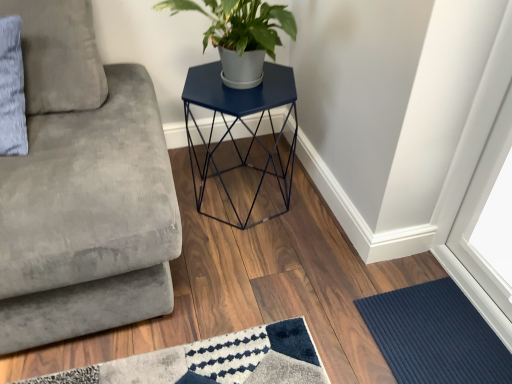
The height and width of the screenshot is (384, 512). What do you see at coordinates (83, 189) in the screenshot? I see `velvet gray studio couch at left` at bounding box center [83, 189].

Image resolution: width=512 pixels, height=384 pixels. I want to click on gray fabric pillow at upper left, so click(59, 55).

Find the location of a particular element. This screenshot has height=384, width=512. matte blue hexagonal table at center is located at coordinates (243, 124).

The width and height of the screenshot is (512, 384). I want to click on navy blue ribbed mat at lower right, so click(435, 336).

Does velvet gray studio couch at left lie in front of matte blue hexagonal table at center?

That is True.

From a real-world perspective, is velvet gray studio couch at left physically above matte blue hexagonal table at center?

Correct, in the physical world, velvet gray studio couch at left is higher than matte blue hexagonal table at center.

Is velvet gray studio couch at left bigger than matte blue hexagonal table at center?

Yes.

How different are the orientations of velvet gray studio couch at left and matte blue hexagonal table at center in degrees?

velvet gray studio couch at left and matte blue hexagonal table at center are facing 89.3 degrees away from each other.

Do you think navy blue ribbed mat at lower right is within matte blue hexagonal table at center, or outside of it?

The correct answer is: outside.

How far apart are navy blue ribbed mat at lower right and matte blue hexagonal table at center?

They are 27.63 inches apart.

What's the angular difference between navy blue ribbed mat at lower right and matte blue hexagonal table at center's facing directions?

The angular difference between navy blue ribbed mat at lower right and matte blue hexagonal table at center is 88 degrees.

In the scene shown: Considering the positions of objects navy blue ribbed mat at lower right and matte blue hexagonal table at center in the image provided, who is more to the right, navy blue ribbed mat at lower right or matte blue hexagonal table at center?

navy blue ribbed mat at lower right is more to the right.

Does point (448, 282) appear closer or farther from the camera than point (35, 64)?

Point (448, 282).

The width and height of the screenshot is (512, 384). In order to click on doormat below the velvet gray studio couch at left (from the image's perspective) in this screenshot , I will do `click(435, 336)`.

In terms of height, does navy blue ribbed mat at lower right look taller or shorter compared to velvet gray studio couch at left?

Clearly, navy blue ribbed mat at lower right is shorter compared to velvet gray studio couch at left.

From the image's perspective, which object appears higher, matte blue hexagonal table at center or navy blue ribbed mat at lower right?

From the image's view, matte blue hexagonal table at center is above.

Which is farther from the camera, [284,79] or [420,357]?

Point [284,79]

Can navy blue ribbed mat at lower right be found inside matte blue hexagonal table at center?

Actually, navy blue ribbed mat at lower right is outside matte blue hexagonal table at center.

Is matte blue hexagonal table at center positioned before navy blue ribbed mat at lower right?

That is False.

Based on the photo, is velvet gray studio couch at left further to camera compared to navy blue ribbed mat at lower right?

No, it is not.

Which is more to the right, velvet gray studio couch at left or navy blue ribbed mat at lower right?

navy blue ribbed mat at lower right is more to the right.

Consider the image. Is velvet gray studio couch at left bigger than navy blue ribbed mat at lower right?

Indeed, velvet gray studio couch at left has a larger size compared to navy blue ribbed mat at lower right.

In the scene shown: From a real-world perspective, is gray fabric pillow at upper left positioned under matte blue hexagonal table at center based on gravity?

No, from a real-world perspective, gray fabric pillow at upper left is not under matte blue hexagonal table at center.

Can matte blue hexagonal table at center be found inside gray fabric pillow at upper left?

That's incorrect, matte blue hexagonal table at center is not inside gray fabric pillow at upper left.

From the image's perspective, is gray fabric pillow at upper left positioned above or below matte blue hexagonal table at center?

gray fabric pillow at upper left is above matte blue hexagonal table at center.

Is the surface of gray fabric pillow at upper left in direct contact with matte blue hexagonal table at center?

gray fabric pillow at upper left and matte blue hexagonal table at center are not in contact.

Which is more to the left, matte blue hexagonal table at center or gray fabric pillow at upper left?

Positioned to the left is gray fabric pillow at upper left.

In terms of width, does matte blue hexagonal table at center look wider or thinner when compared to gray fabric pillow at upper left?

matte blue hexagonal table at center is wider than gray fabric pillow at upper left.

Is matte blue hexagonal table at center inside the boundaries of gray fabric pillow at upper left, or outside?

matte blue hexagonal table at center is not inside gray fabric pillow at upper left, it's outside.

Identify the location of studio couch in front of the matte blue hexagonal table at center. (83, 189).

Find the location of a particular element. Image resolution: width=512 pixels, height=384 pixels. table located above the navy blue ribbed mat at lower right (from a real-world perspective) is located at coordinates pyautogui.click(x=243, y=124).

Which object lies further to the anchor point gray fabric pillow at upper left, navy blue ribbed mat at lower right or velvet gray studio couch at left?

Among the two, navy blue ribbed mat at lower right is located further to gray fabric pillow at upper left.

Considering their positions, is velvet gray studio couch at left positioned further to navy blue ribbed mat at lower right than matte blue hexagonal table at center?

velvet gray studio couch at left is positioned further to the anchor navy blue ribbed mat at lower right.

Considering their positions, is gray fabric pillow at upper left positioned closer to navy blue ribbed mat at lower right than matte blue hexagonal table at center?

matte blue hexagonal table at center lies closer to navy blue ribbed mat at lower right than the other object.

Considering their positions, is velvet gray studio couch at left positioned closer to matte blue hexagonal table at center than gray fabric pillow at upper left?

velvet gray studio couch at left is positioned closer to the anchor matte blue hexagonal table at center.

When comparing their distances from matte blue hexagonal table at center, does gray fabric pillow at upper left or navy blue ribbed mat at lower right seem closer?

gray fabric pillow at upper left lies closer to matte blue hexagonal table at center than the other object.

Based on their spatial positions, is gray fabric pillow at upper left or navy blue ribbed mat at lower right further from velvet gray studio couch at left?

navy blue ribbed mat at lower right.

Estimate the real-world distances between objects in this image. Which object is closer to matte blue hexagonal table at center, gray fabric pillow at upper left or velvet gray studio couch at left?

velvet gray studio couch at left.

Based on their spatial positions, is gray fabric pillow at upper left or matte blue hexagonal table at center closer to velvet gray studio couch at left?

The object closer to velvet gray studio couch at left is gray fabric pillow at upper left.

In order to click on table between gray fabric pillow at upper left and navy blue ribbed mat at lower right from left to right in this screenshot , I will do click(243, 124).

Locate an element on the screen. The image size is (512, 384). pillow located between velvet gray studio couch at left and matte blue hexagonal table at center in the depth direction is located at coordinates (59, 55).

Locate an element on the screen. studio couch between gray fabric pillow at upper left and navy blue ribbed mat at lower right from left to right is located at coordinates (83, 189).

In order to click on table between velvet gray studio couch at left and navy blue ribbed mat at lower right in the horizontal direction in this screenshot , I will do `click(243, 124)`.